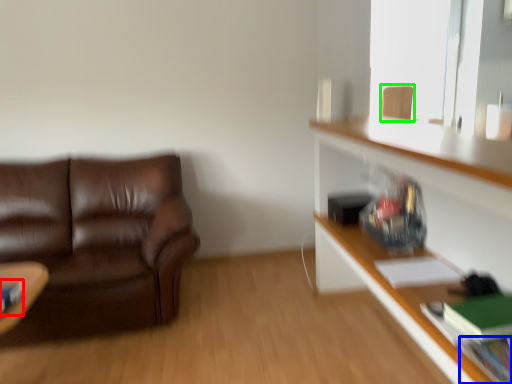
Question: Considering the real-world distances, which object is farthest from book (highlighted by a red box)? book (highlighted by a blue box) or swivel chair (highlighted by a green box)?

Choices:
 (A) book
 (B) swivel chair

Answer: (B)